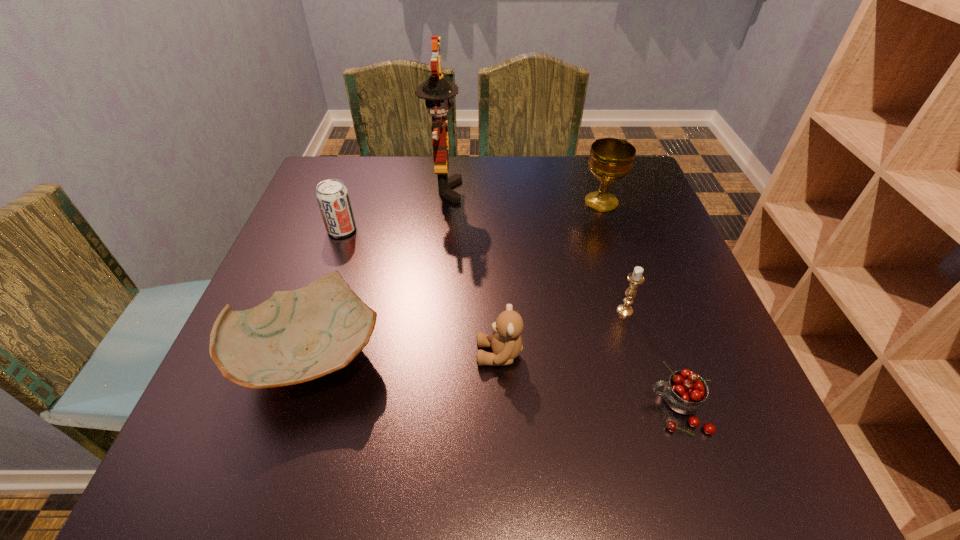
I want to click on free spot that satisfies the following two spatial constraints: 1. on the front-facing side of the nutcracker; 2. on the handle side of the cherry, so click(x=421, y=409).